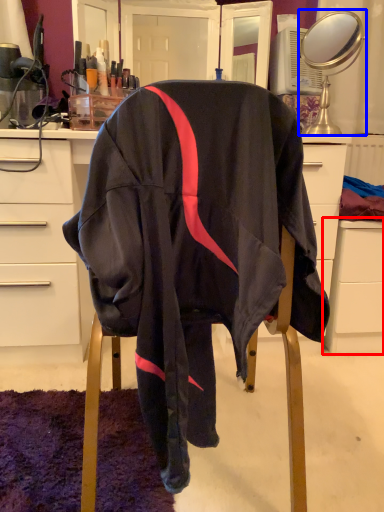
Question: Which object appears closest to the camera in this image, file cabinet (highlighted by a red box) or mirror (highlighted by a blue box)?

Choices:
 (A) file cabinet
 (B) mirror

Answer: (B)